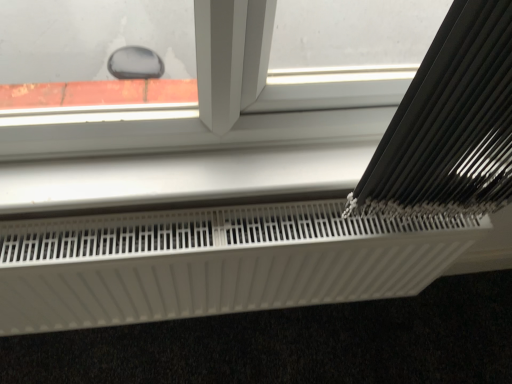
Where is `white matte radiator at lower center`? This screenshot has width=512, height=384. white matte radiator at lower center is located at coordinates (215, 262).

The image size is (512, 384). Describe the element at coordinates (215, 262) in the screenshot. I see `white matte radiator at lower center` at that location.

Where is `white matte radiator at lower center`? The height and width of the screenshot is (384, 512). white matte radiator at lower center is located at coordinates (215, 262).